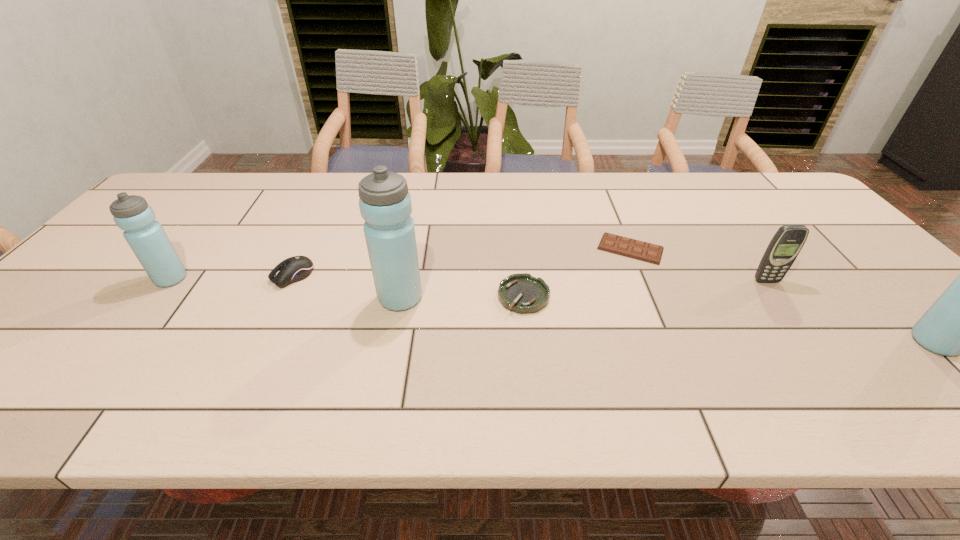
The image size is (960, 540). Identify the location of the leftmost object. (146, 237).

The width and height of the screenshot is (960, 540). Identify the location of the shortest water bottle. (146, 237).

The height and width of the screenshot is (540, 960). What are the coordinates of `the fifth object from right to left` in the screenshot? It's located at (385, 204).

The image size is (960, 540). What are the coordinates of `chocolate bar` in the screenshot? It's located at [640, 250].

Where is `the shortest object`? The image size is (960, 540). the shortest object is located at coordinates (640, 250).

Identify the location of the second object from right to left. The image size is (960, 540). (783, 249).

Locate an element on the screen. The image size is (960, 540). the fourth tallest object is located at coordinates (783, 249).

Locate an element on the screen. the second object from left to right is located at coordinates (296, 268).

Find the location of a particular element. the fifth tallest object is located at coordinates (296, 268).

Find the location of a particular element. This screenshot has width=960, height=540. ashtray is located at coordinates (522, 293).